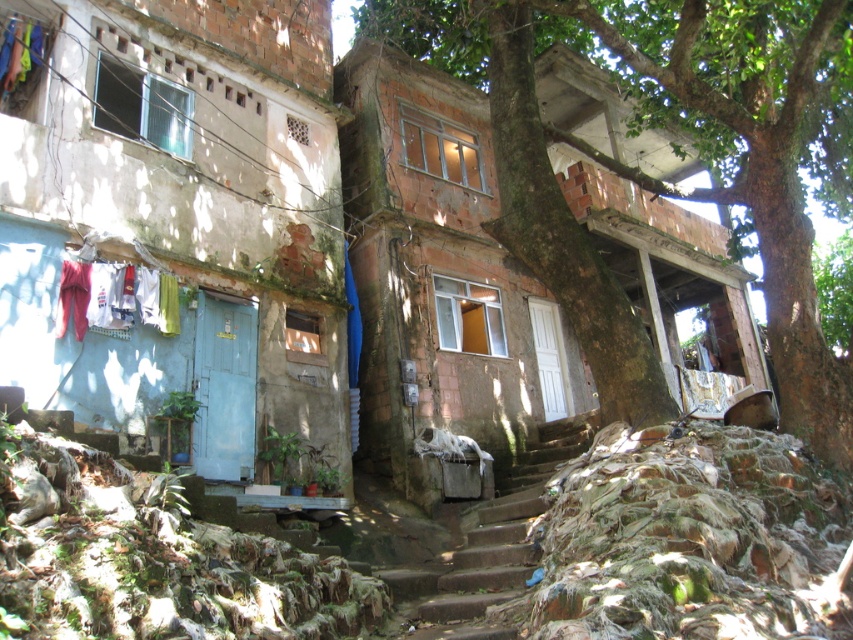
Consider the image. You are standing at the entrance of the building on the left with the light blue door. You want to go to the building on the right with the white door. There is a rusty concrete stairs at center represented by point (x=486, y=548). Can you walk directly to the building on the right without going around the stairs?

The rusty concrete stairs at center is located at point (x=486, y=548), which is directly between the two buildings. Therefore, you would need to go around the stairs to reach the building on the right with the white door.